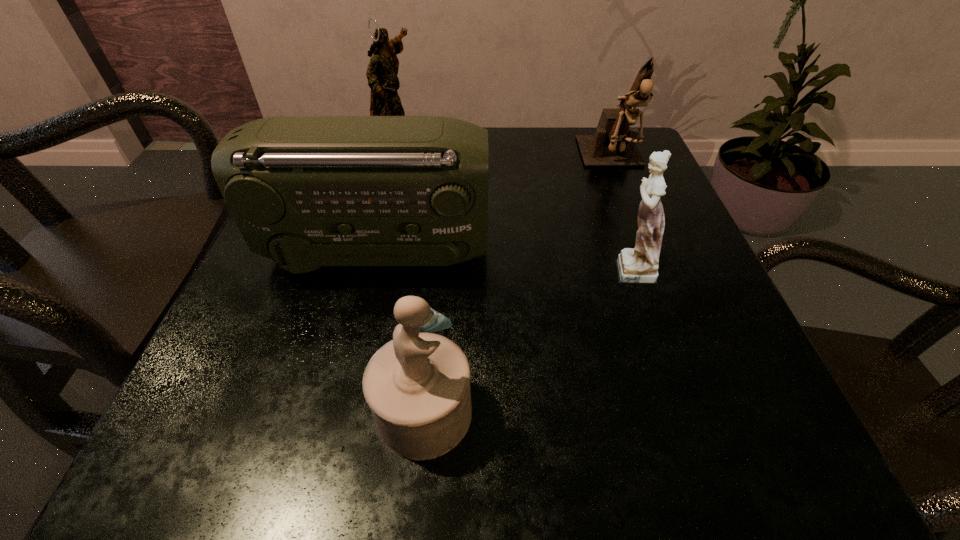
Locate an element on the screen. the closest object to the radio_receiver is located at coordinates (417, 385).

You are a GUI agent. You are given a task and a screenshot of the screen. Output one action in this format:
    pyautogui.click(x=<x>, y=<y>)
    Task: Click on the figurine object that ranks as the closest to the radio_receiver
    The image size is (960, 540).
    Given the screenshot: What is the action you would take?
    pyautogui.click(x=417, y=385)

Find the location of `figurine identified as the second closest to the radio_receiver`. figurine identified as the second closest to the radio_receiver is located at coordinates (382, 71).